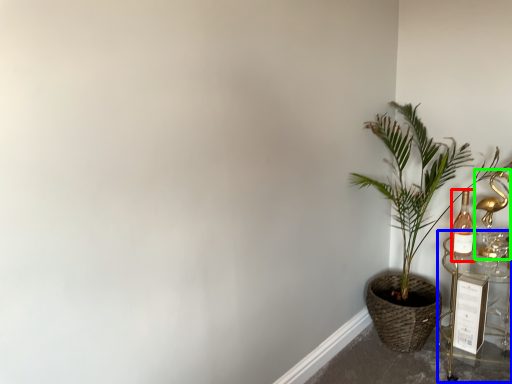
Question: Based on their relative distances, which object is nearer to bottle (highlighted by a red box)? Choose from table (highlighted by a blue box) and candle holder (highlighted by a green box).

Choices:
 (A) table
 (B) candle holder

Answer: (B)